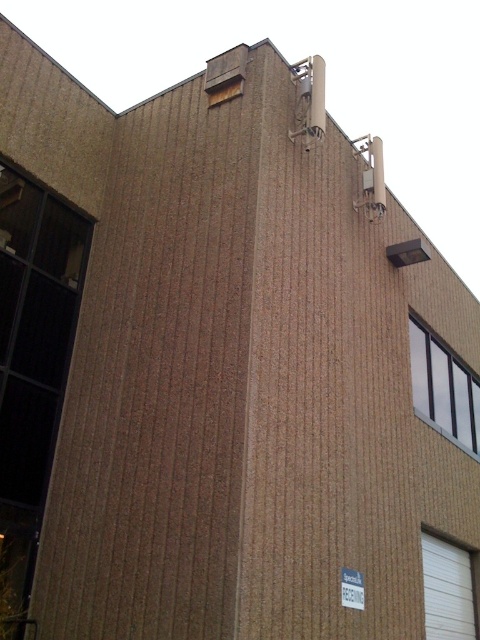
Locate an element on the screen. This screenshot has width=480, height=640. white glass window at upper center is located at coordinates (444, 388).

Does white glass window at upper center have a greater width compared to white plastic sign at lower center?

Correct, the width of white glass window at upper center exceeds that of white plastic sign at lower center.

Is point (456, 426) positioned in front of point (352, 595)?

No, (456, 426) is behind (352, 595).

Identify the location of white glass window at upper center. The image size is (480, 640). (444, 388).

Can you confirm if white glass window at upper center is positioned to the left of white textured door at lower right?

No, white glass window at upper center is not to the left of white textured door at lower right.

Does white glass window at upper center appear over white textured door at lower right?

Indeed, white glass window at upper center is positioned over white textured door at lower right.

This screenshot has width=480, height=640. What do you see at coordinates (444, 388) in the screenshot?
I see `white glass window at upper center` at bounding box center [444, 388].

Where is `white glass window at upper center`? This screenshot has height=640, width=480. white glass window at upper center is located at coordinates (444, 388).

Between point (464, 600) and point (342, 588), which one is positioned in front?

Point (342, 588) is more forward.

Is white textured door at lower right closer to camera compared to white plastic sign at lower center?

No, white textured door at lower right is behind white plastic sign at lower center.

Is point (457, 547) farther from camera compared to point (347, 588)?

Yes, point (457, 547) is farther from viewer.

Find the location of `white textured door at lower right`. white textured door at lower right is located at coordinates tap(447, 589).